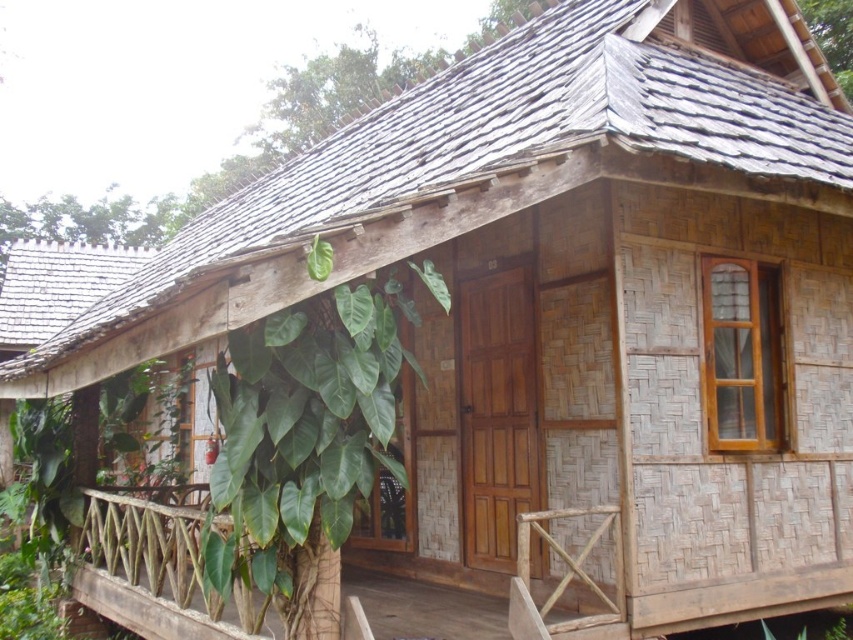
Looking at this image, can you confirm if green glossy leafy plant at center is positioned to the left of natural wood porch at center?

Yes, green glossy leafy plant at center is to the left of natural wood porch at center.

Is green glossy leafy plant at center in front of natural wood porch at center?

Yes.

Image resolution: width=853 pixels, height=640 pixels. What do you see at coordinates (302, 435) in the screenshot? I see `green glossy leafy plant at center` at bounding box center [302, 435].

Image resolution: width=853 pixels, height=640 pixels. What are the coordinates of `green glossy leafy plant at center` in the screenshot? It's located at (302, 435).